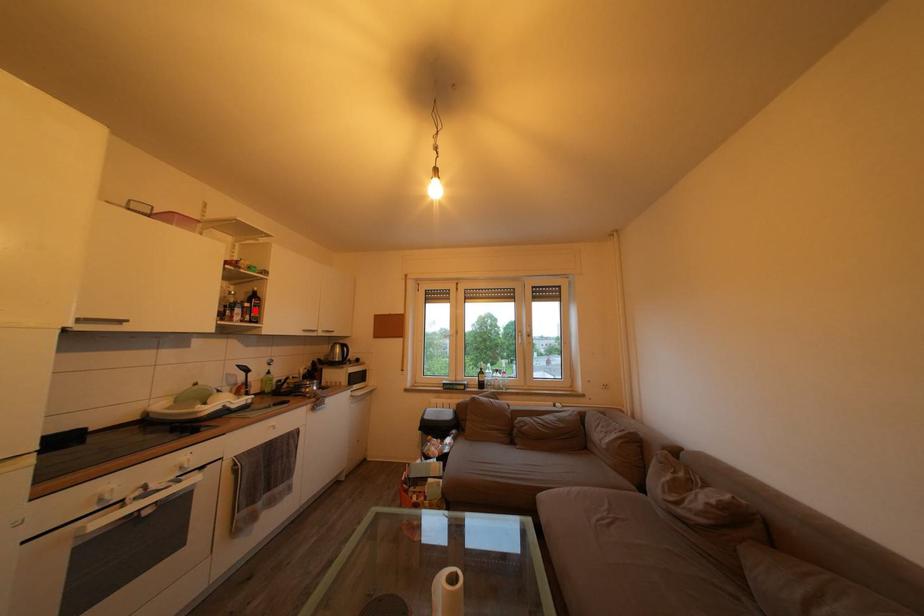
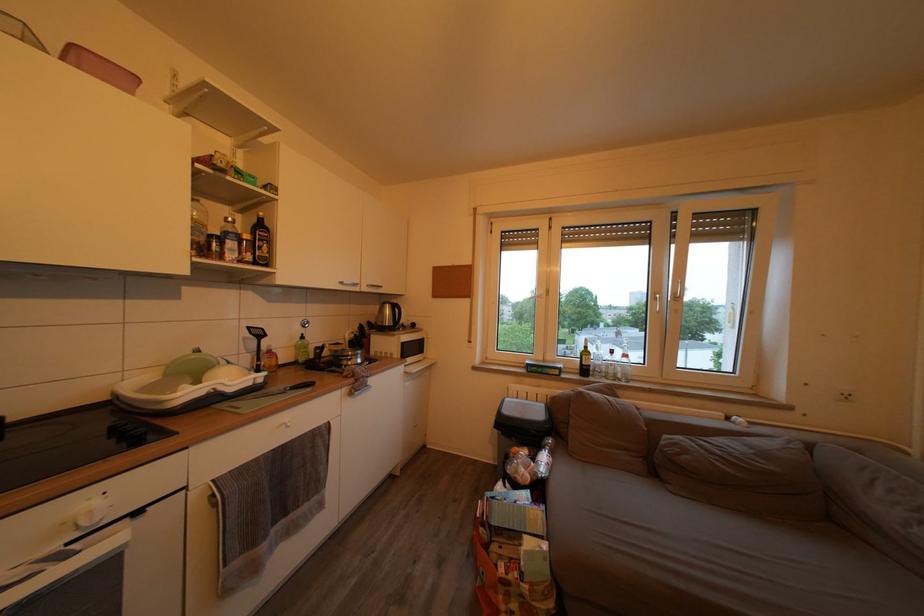
Find the pixel in the second image that matches the highlighted location in the first image.

(253, 243)